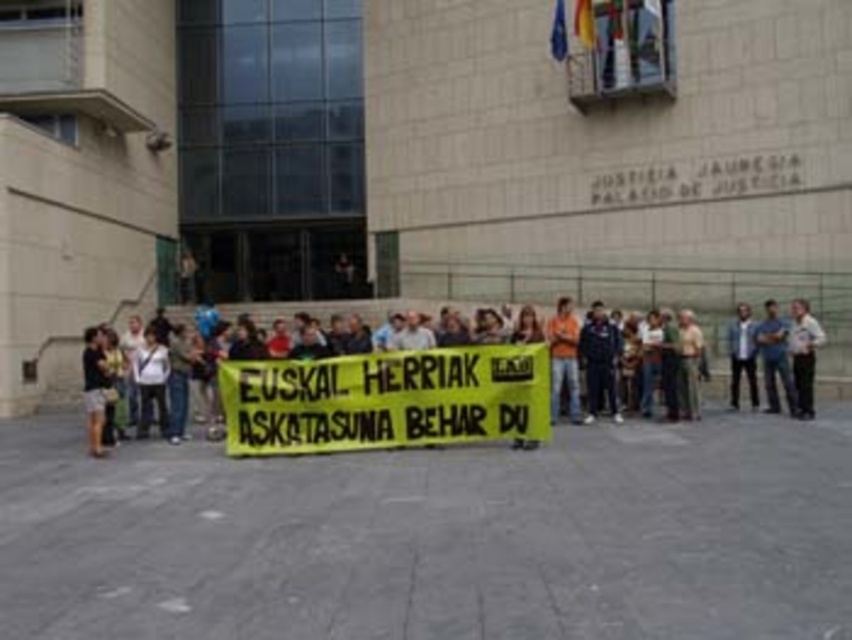
Which of these two, dark blue jeans at center or denim jacket at center, stands shorter?

Standing shorter between the two is denim jacket at center.

Is dark blue jeans at center thinner than denim jacket at center?

Yes, dark blue jeans at center is thinner than denim jacket at center.

Identify the location of dark blue jeans at center. This screenshot has width=852, height=640. (774, 356).

In the scene shown: Who is lower down, yellow fabric banner at center or denim jacket at center?

denim jacket at center is lower down.

Which is in front, point (275, 426) or point (740, 346)?

Positioned in front is point (275, 426).

Between point (254, 372) and point (730, 392), which one is positioned behind?

The point (730, 392) is behind.

Where is `yellow fabric banner at center`? yellow fabric banner at center is located at coordinates (367, 380).

The height and width of the screenshot is (640, 852). In order to click on light brown leather jacket at center in this screenshot , I will do `click(803, 353)`.